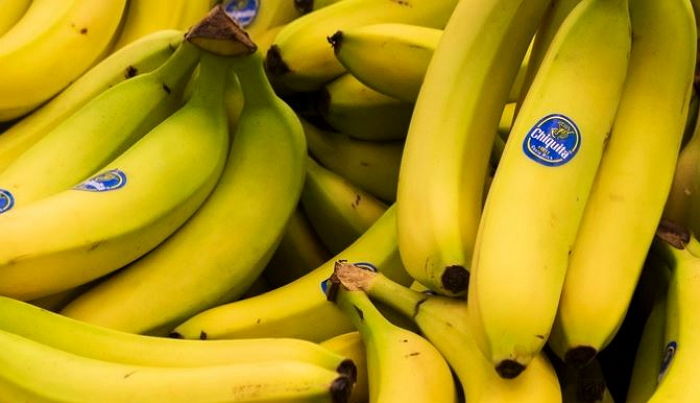
You are a GUI agent. You are given a task and a screenshot of the screen. Output one action in this format:
    pyautogui.click(x=<x>, y=<y>)
    Task: Click on the stickers
    The image size is (700, 403).
    Given the screenshot: What is the action you would take?
    pyautogui.click(x=553, y=146), pyautogui.click(x=243, y=17), pyautogui.click(x=106, y=188), pyautogui.click(x=10, y=204), pyautogui.click(x=326, y=285), pyautogui.click(x=668, y=361)